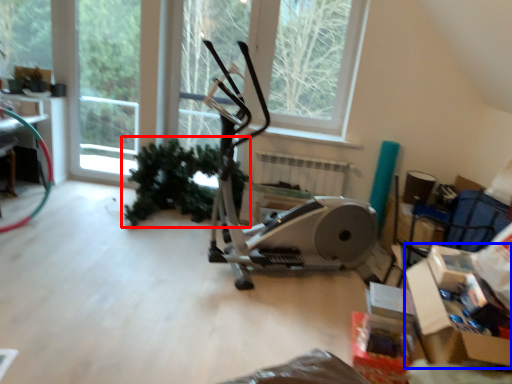
Question: Which object appears closest to the camera in this image, plant (highlighted by a red box) or cardboard box (highlighted by a blue box)?

Choices:
 (A) plant
 (B) cardboard box

Answer: (B)